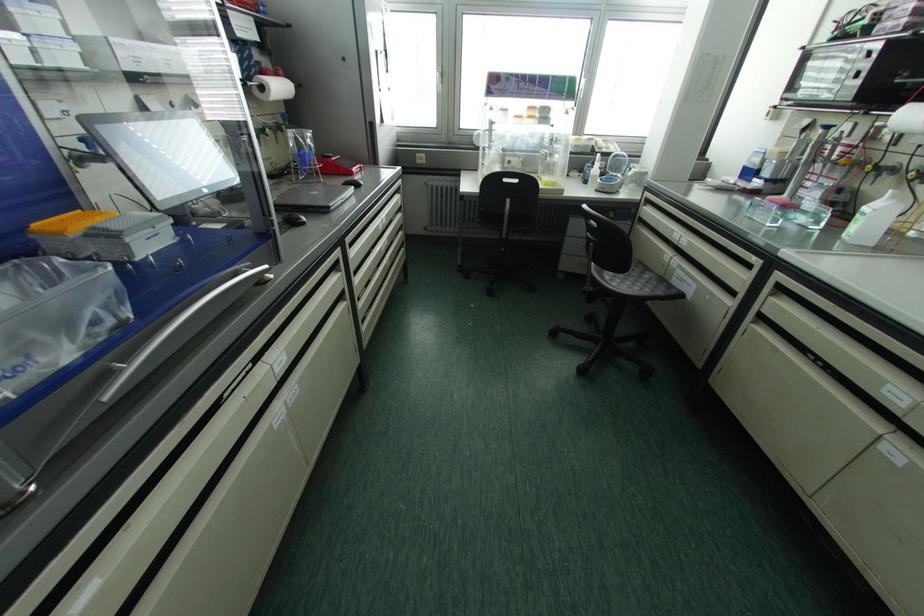
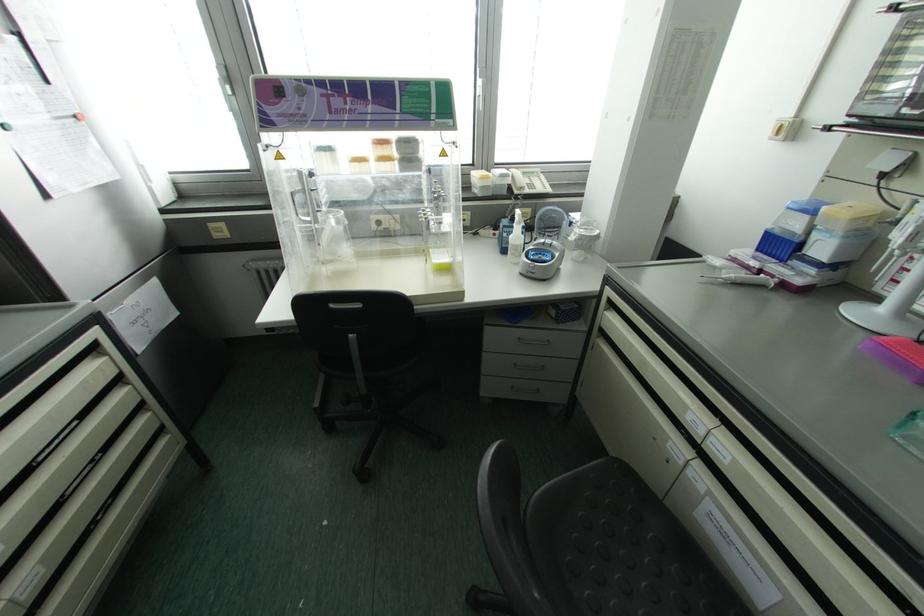
Find the pixel in the second image that matches (585,180) in the first image.

(504, 251)